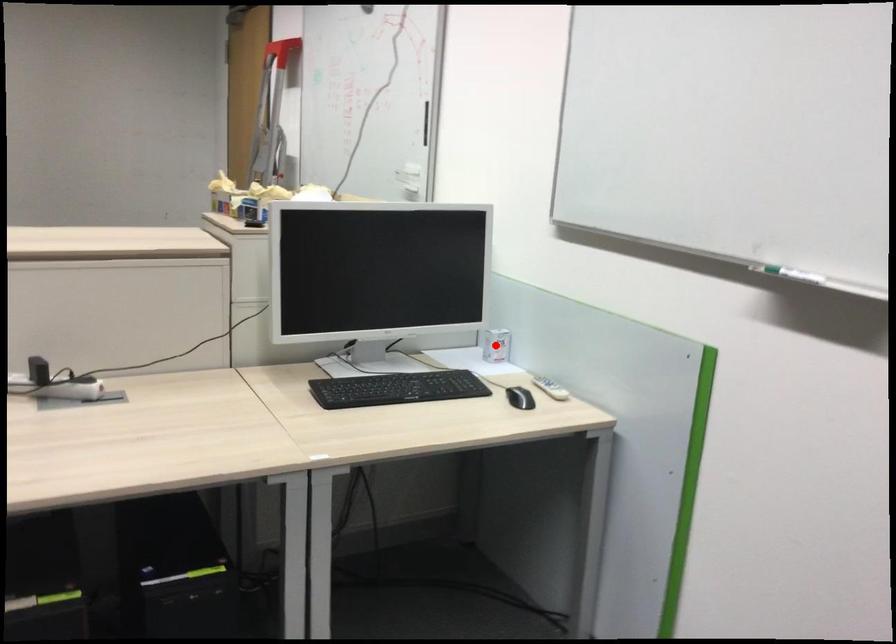
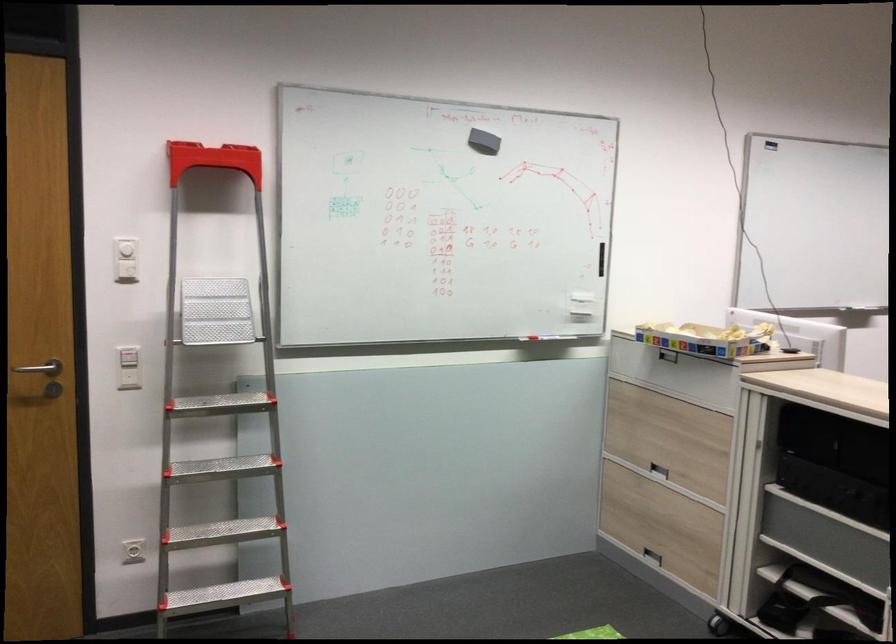
Question: I am providing you with two images of the same scene from different viewpoints. A red point is marked on the first image. At the location where the point appears in image 1, is it still visible in image 2?

Choices:
 (A) Yes
 (B) No

Answer: (B)